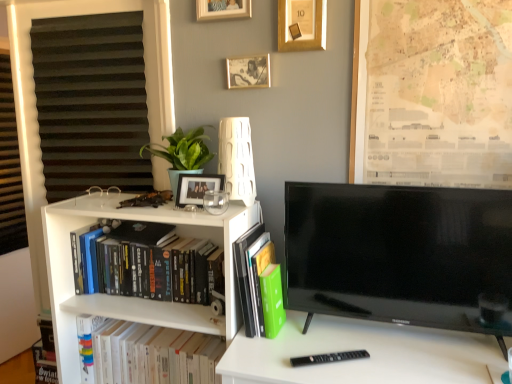
This screenshot has height=384, width=512. I want to click on free space in front of green matte book at center, the second book from the top, so click(x=268, y=358).